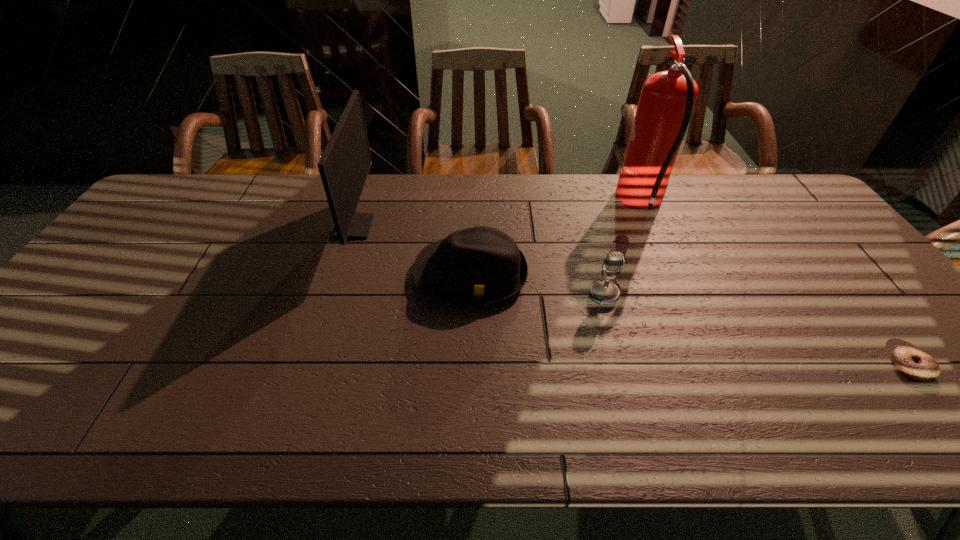
Locate an element on the screen. The image size is (960, 540). vacant area at the near edge is located at coordinates (313, 432).

This screenshot has height=540, width=960. In the image, there is a desktop. Identify the location of vacant space at the left edge. (72, 312).

This screenshot has width=960, height=540. I want to click on vacant region at the right edge of the desktop, so click(x=918, y=399).

Where is `free location at the far left corner of the desktop`? The image size is (960, 540). free location at the far left corner of the desktop is located at coordinates (190, 208).

Locate an element on the screen. This screenshot has width=960, height=540. vacant region at the far right corner of the desktop is located at coordinates (803, 199).

Locate an element on the screen. unoccupied position between the fourth shortest object and the doughnut is located at coordinates (633, 297).

At what (x,y) coordinates should I click in order to perform the action: click on free space between the second shortest object and the rightmost object. Please return your answer as a coordinate pair (x, y). The image size is (960, 540). Looking at the image, I should click on (690, 321).

Locate an element on the screen. empty space that is in between the computer monitor and the fedora is located at coordinates (413, 251).

The height and width of the screenshot is (540, 960). I want to click on vacant point located between the fedora and the fire extinguisher, so click(x=557, y=239).

Locate an element on the screen. Image resolution: width=960 pixels, height=540 pixels. free spot between the rightmost object and the second object from left to right is located at coordinates (690, 321).